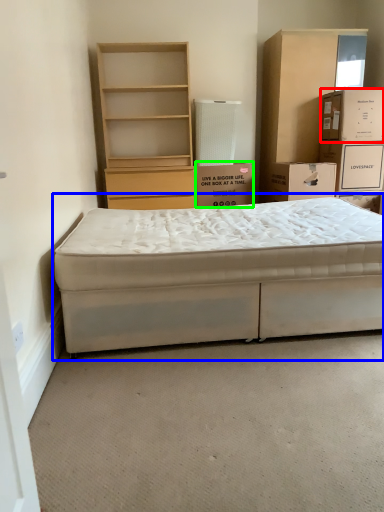
Question: Considering the real-world distances, which object is closest to box (highlighted by a red box)? bed (highlighted by a blue box) or box (highlighted by a green box).

Choices:
 (A) bed
 (B) box

Answer: (B)